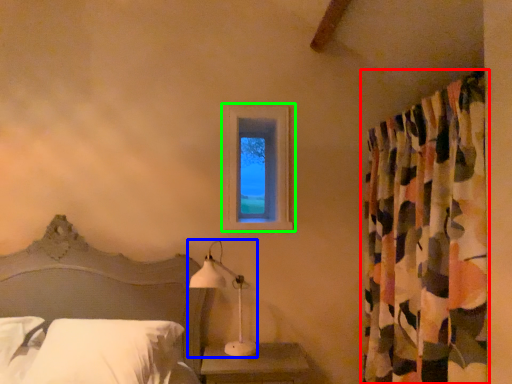
Question: Which object is the closest to the curtain (highlighted by a red box)? Choose among these: table lamp (highlighted by a blue box) or window (highlighted by a green box).

Choices:
 (A) table lamp
 (B) window

Answer: (B)